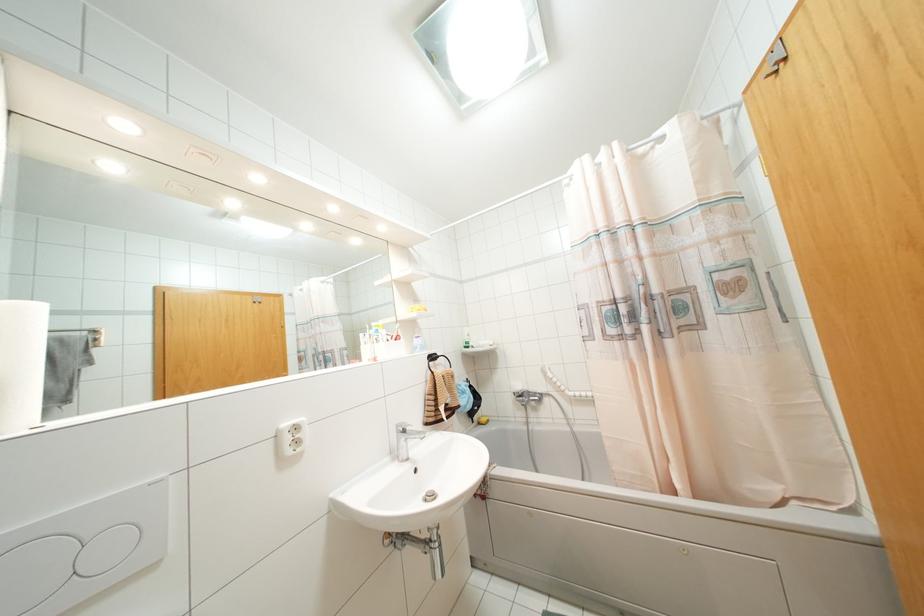
Locate an element on the screen. This screenshot has height=616, width=924. sink drain plug is located at coordinates (429, 496).